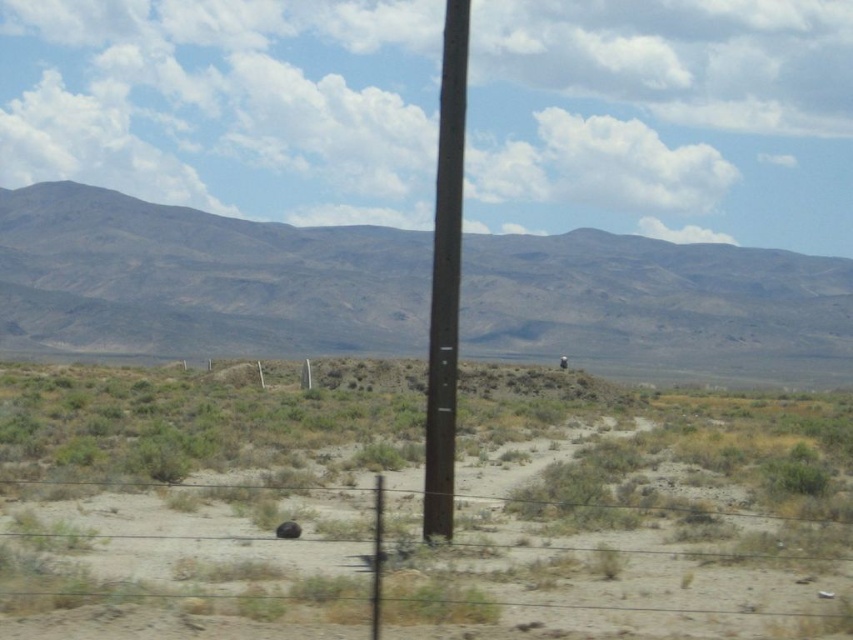
You are a hiker trying to navigate through the desert. You see the brown sandy dirt at center and the brown wooden pole at center. Which object is closer to you?

The brown sandy dirt at center is closer to the viewer than the brown wooden pole at center.

You are standing in the desert scene and want to reach a point that is exactly 100 feet away from your current position. There is a point marked at coordinates point (312, 448). Can you use this point as your target destination?

The point (312, 448) is 105.80 feet from the viewer, which is 5.8 feet beyond the desired 100 feet distance. Therefore, it cannot be used as the exact target destination.